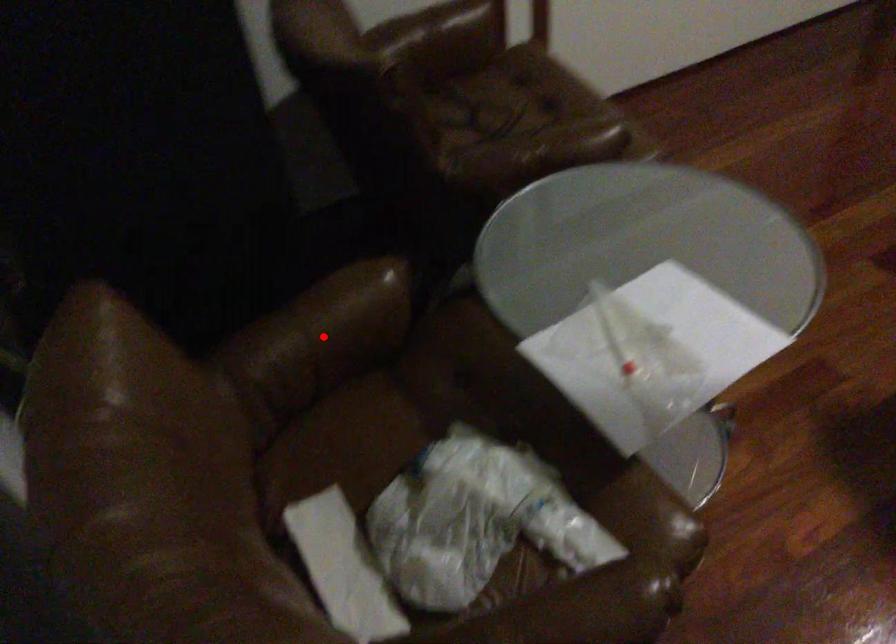
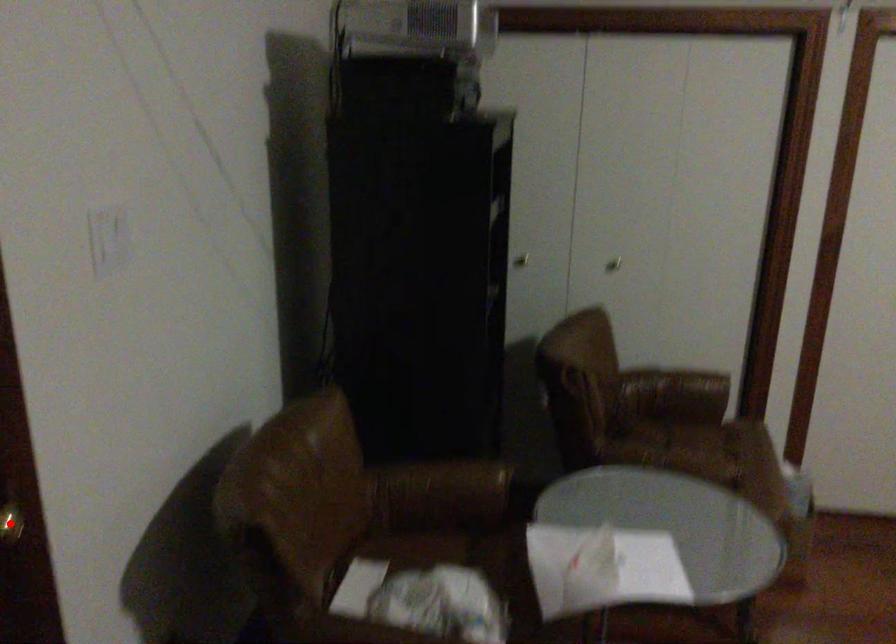
I am providing you with two images of the same scene from different viewpoints. A red point is marked on the first image and another point is marked on the second image. Does the point marked in image1 correspond to the same location as the one in image2?

No